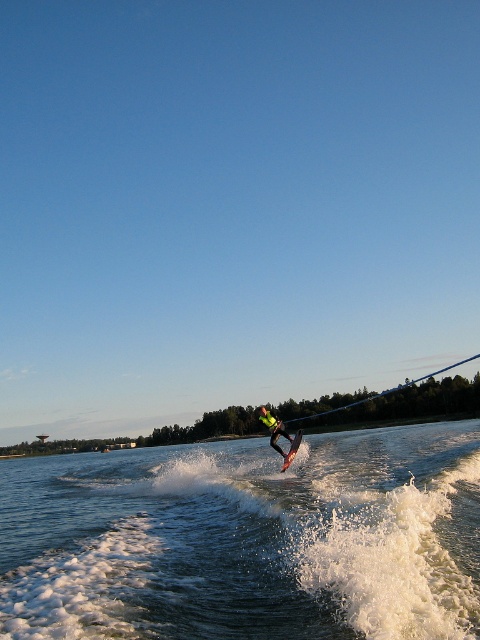
What is the exact coordinate of the translucent water at center?

The translucent water at center is located at point (248, 540).